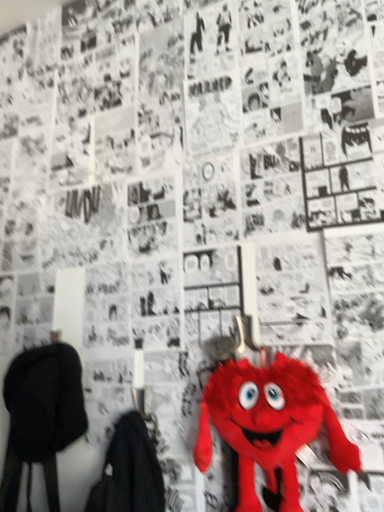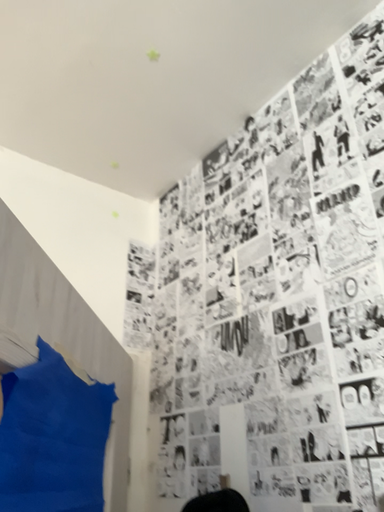
Question: How did the camera likely rotate when shooting the video?

Choices:
 (A) rotated right
 (B) rotated left

Answer: (B)